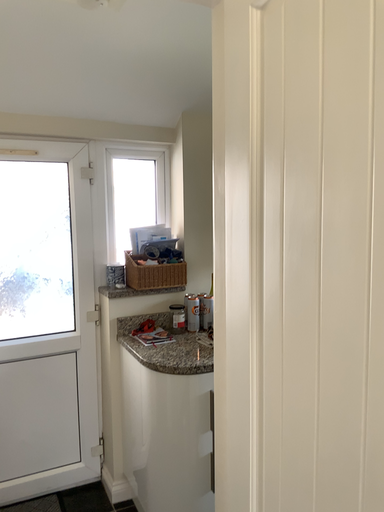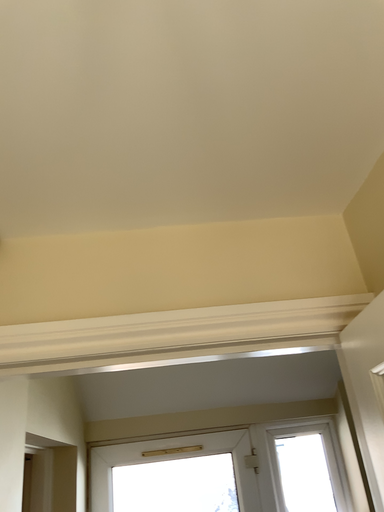
Question: Which way did the camera rotate in the video?

Choices:
 (A) rotated left
 (B) rotated right

Answer: (A)